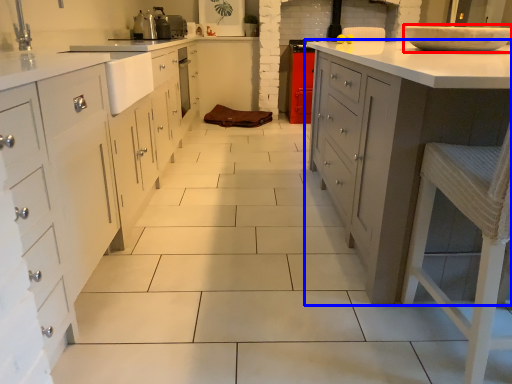
Question: Which object is further to the camera taking this photo, home appliance (highlighted by a red box) or countertop (highlighted by a blue box)?

Choices:
 (A) home appliance
 (B) countertop

Answer: (A)